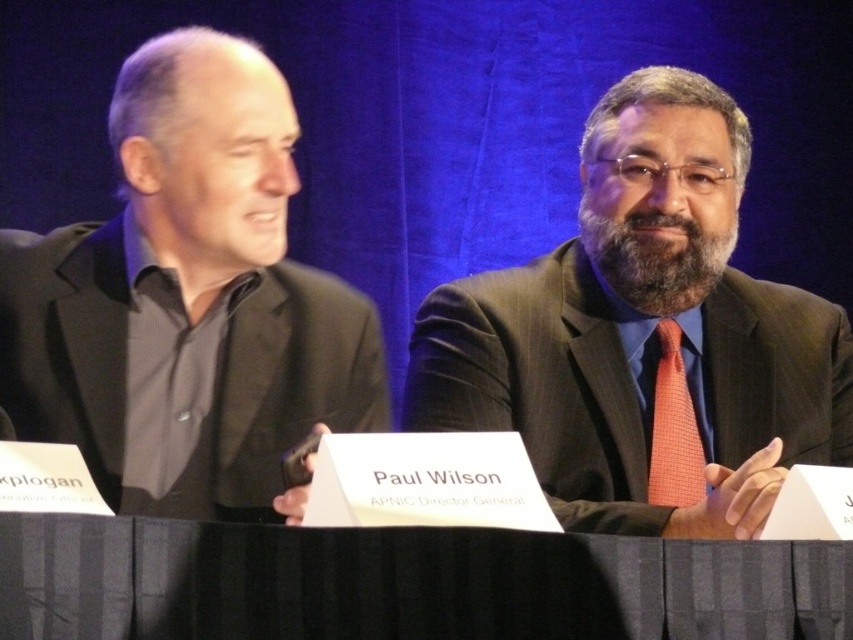
Is matte black suit at right below orange checkered tie at center?

Actually, matte black suit at right is above orange checkered tie at center.

Does point (518, 317) come closer to viewer compared to point (666, 364)?

That is True.

This screenshot has width=853, height=640. Identify the location of matte black suit at right. (643, 336).

Can you confirm if black matte suit at left is positioned to the left of orange checkered tie at center?

Correct, you'll find black matte suit at left to the left of orange checkered tie at center.

Does black matte suit at left have a lesser width compared to orange checkered tie at center?

In fact, black matte suit at left might be wider than orange checkered tie at center.

This screenshot has width=853, height=640. What are the coordinates of `black matte suit at left` in the screenshot? It's located at (187, 300).

Is point (189, 566) in front of point (675, 460)?

Yes, point (189, 566) is closer to viewer.

Is black fabric table at center below orange checkered tie at center?

Indeed, black fabric table at center is positioned under orange checkered tie at center.

Who is more forward, [97,616] or [682,365]?

Point [97,616] is in front.

The height and width of the screenshot is (640, 853). What are the coordinates of `black fabric table at center` in the screenshot? It's located at (405, 582).